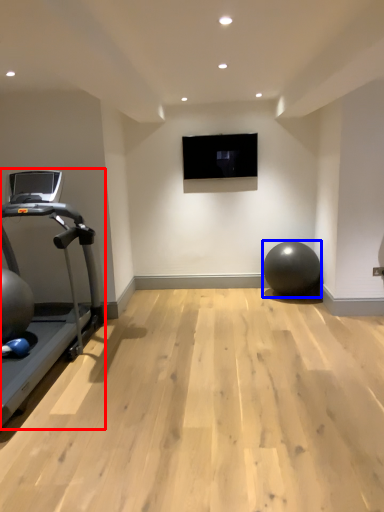
Question: Which of the following is the farthest to the observer, treadmill (highlighted by a red box) or ball (highlighted by a blue box)?

Choices:
 (A) treadmill
 (B) ball

Answer: (B)